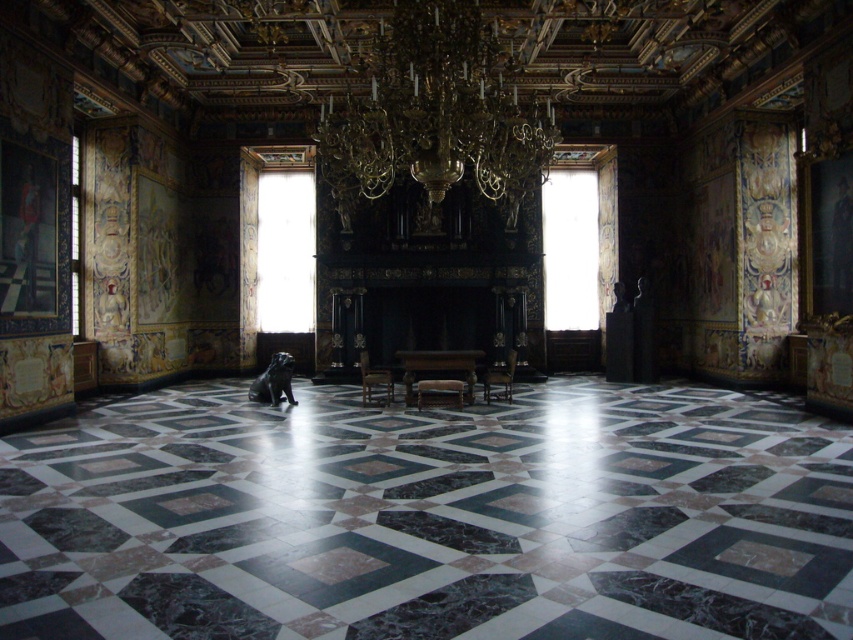
Does wooden polished chair at center have a larger size compared to wooden chair at center?

Yes.

Locate an element on the screen. The width and height of the screenshot is (853, 640). wooden polished chair at center is located at coordinates (375, 381).

Which is in front, point (392, 74) or point (381, 376)?

Positioned in front is point (392, 74).

Is gold/gilded metal chandelier at upper center to the right of wooden polished chair at center from the viewer's perspective?

Correct, you'll find gold/gilded metal chandelier at upper center to the right of wooden polished chair at center.

The height and width of the screenshot is (640, 853). Identify the location of gold/gilded metal chandelier at upper center. (436, 112).

Is gold/gilded metal chandelier at upper center above wooden chair at center?

Yes, gold/gilded metal chandelier at upper center is above wooden chair at center.

Who is positioned more to the right, gold/gilded metal chandelier at upper center or wooden chair at center?

wooden chair at center

Locate an element on the screen. This screenshot has height=640, width=853. gold/gilded metal chandelier at upper center is located at coordinates (436, 112).